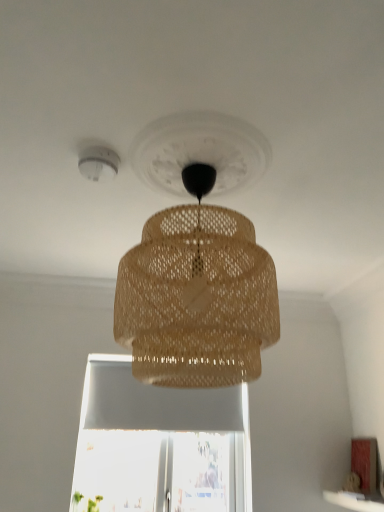
Question: Considering the relative sizes of white matte window sill at lower right and brown woven lampshade at center in the image provided, is white matte window sill at lower right thinner than brown woven lampshade at center?

Choices:
 (A) no
 (B) yes

Answer: (B)

Question: From the image's perspective, does white matte window sill at lower right appear higher than brown woven lampshade at center?

Choices:
 (A) no
 (B) yes

Answer: (A)

Question: Is white matte window sill at lower right touching brown woven lampshade at center?

Choices:
 (A) no
 (B) yes

Answer: (A)

Question: From a real-world perspective, is white matte window sill at lower right over brown woven lampshade at center?

Choices:
 (A) yes
 (B) no

Answer: (B)

Question: Can you confirm if white matte window sill at lower right is wider than brown woven lampshade at center?

Choices:
 (A) no
 (B) yes

Answer: (A)

Question: Visually, is brown woven lampshade at center positioned to the left or to the right of white matte window sill at lower right?

Choices:
 (A) right
 (B) left

Answer: (B)

Question: Is brown woven lampshade at center in front of or behind white matte window sill at lower right in the image?

Choices:
 (A) front
 (B) behind

Answer: (A)

Question: From a real-world perspective, is brown woven lampshade at center physically located above or below white matte window sill at lower right?

Choices:
 (A) below
 (B) above

Answer: (B)

Question: Would you say brown woven lampshade at center is inside or outside white matte window sill at lower right?

Choices:
 (A) inside
 (B) outside

Answer: (B)

Question: In terms of size, does white plastic smoke detector at upper left appear bigger or smaller than white matte window sill at lower right?

Choices:
 (A) big
 (B) small

Answer: (B)

Question: Which is correct: white plastic smoke detector at upper left is inside white matte window sill at lower right, or outside of it?

Choices:
 (A) outside
 (B) inside

Answer: (A)

Question: From the image's perspective, is white plastic smoke detector at upper left located above or below white matte window sill at lower right?

Choices:
 (A) below
 (B) above

Answer: (B)

Question: In the image, is white plastic smoke detector at upper left positioned in front of or behind white matte window sill at lower right?

Choices:
 (A) behind
 (B) front

Answer: (B)

Question: From a real-world perspective, is brown woven lampshade at center physically located above or below white plastic smoke detector at upper left?

Choices:
 (A) below
 (B) above

Answer: (A)

Question: Is brown woven lampshade at center in front of or behind white plastic smoke detector at upper left in the image?

Choices:
 (A) behind
 (B) front

Answer: (B)